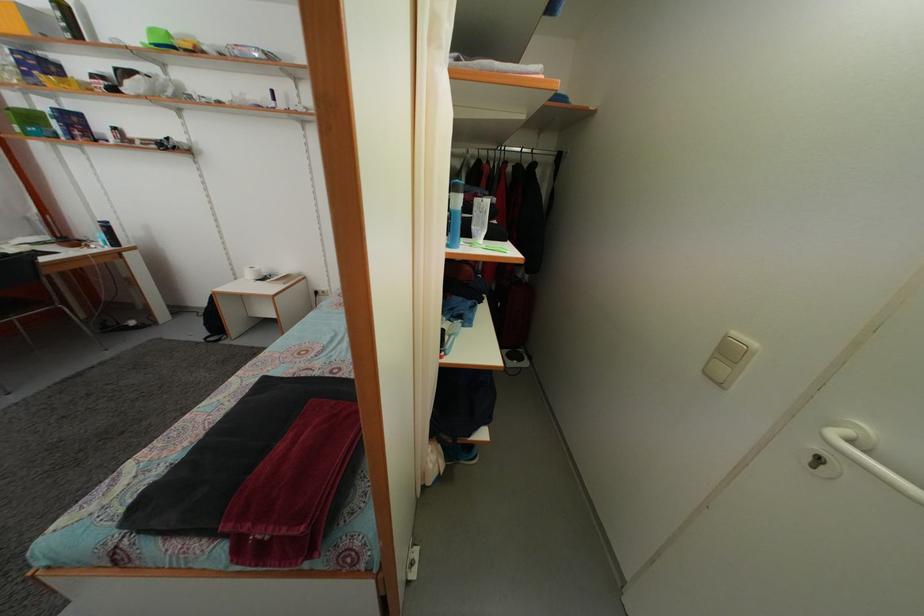
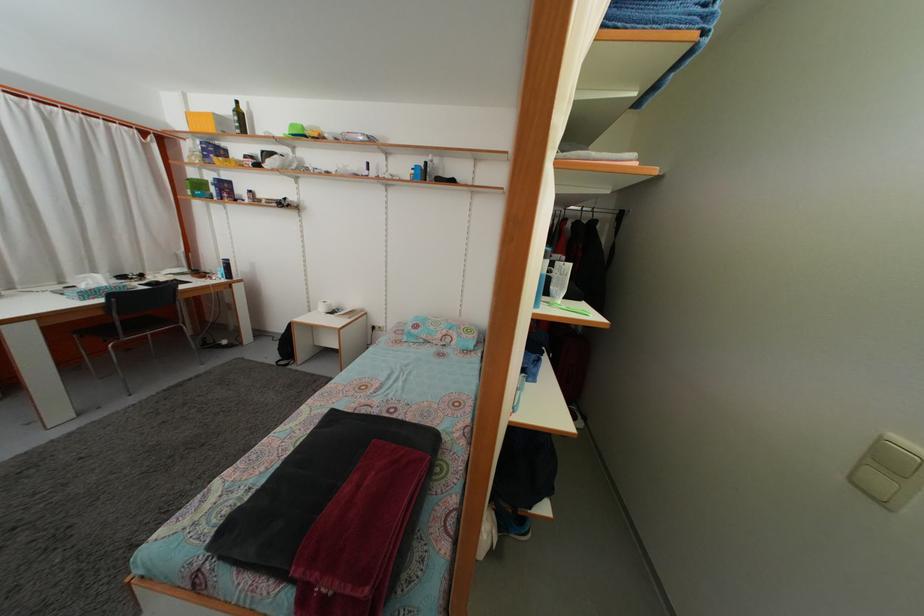
In the second image, find the point that corresponds to pixel 105 244 in the first image.

(226, 278)